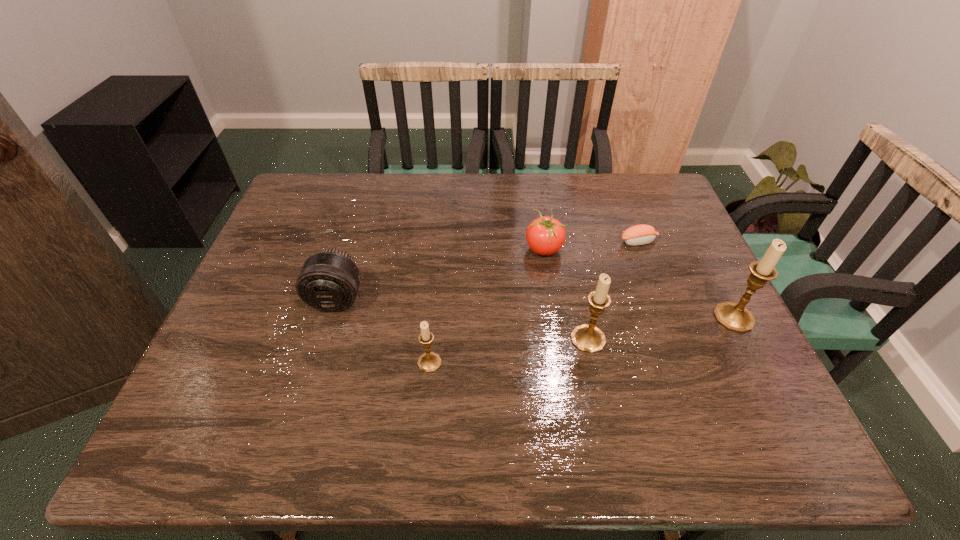
The height and width of the screenshot is (540, 960). I want to click on the fifth object from right to left, so tap(429, 362).

Image resolution: width=960 pixels, height=540 pixels. What are the coordinates of `the shortest candle holder` in the screenshot? It's located at (429, 362).

At what (x,y) coordinates should I click in order to perform the action: click on the fifth shortest object. Please return your answer as a coordinate pair (x, y). Image resolution: width=960 pixels, height=540 pixels. Looking at the image, I should click on (587, 338).

The width and height of the screenshot is (960, 540). Identify the location of the second candle holder from right to left. (587, 338).

The width and height of the screenshot is (960, 540). In order to click on the rightmost object in this screenshot , I will do `click(735, 317)`.

Locate an element on the screen. the fifth object from left to right is located at coordinates (642, 234).

Identify the location of sushi. The image size is (960, 540). (642, 234).

This screenshot has height=540, width=960. In order to click on the leftmost object in this screenshot , I will do [329, 281].

This screenshot has width=960, height=540. I want to click on the second shortest object, so (545, 235).

Where is `free space located 0.340m on the back of the fifth object from right to left`? The height and width of the screenshot is (540, 960). free space located 0.340m on the back of the fifth object from right to left is located at coordinates (440, 252).